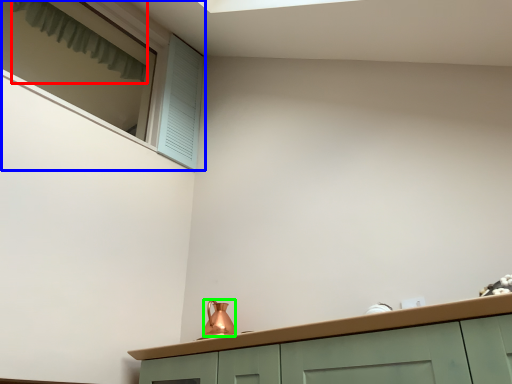
Question: Considering the real-world distances, which object is farthest from curtain (highlighted by a red box)? window (highlighted by a blue box) or tea pot (highlighted by a green box)?

Choices:
 (A) window
 (B) tea pot

Answer: (B)